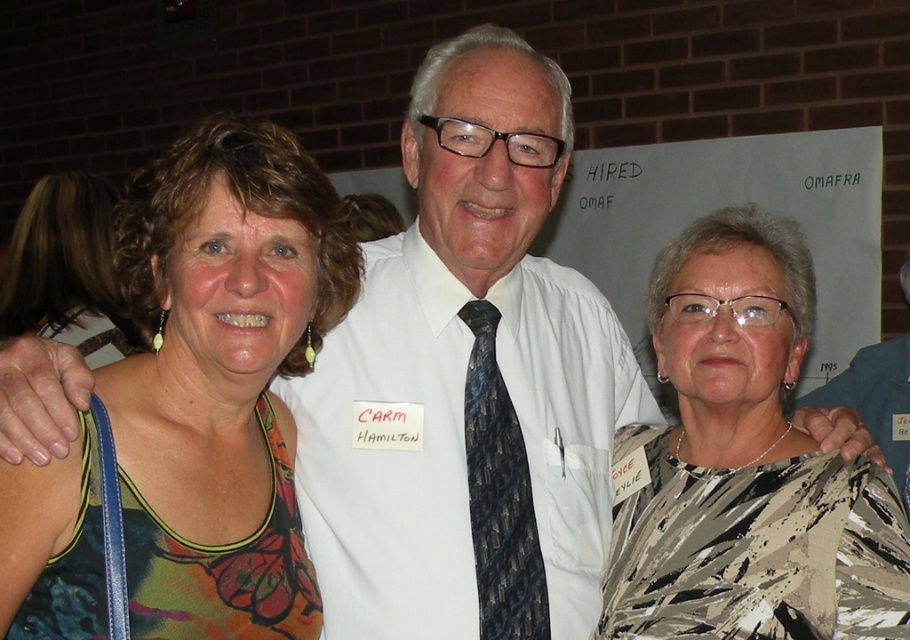
Question: Is multicolored fabric top at center wider than printed silk blouse at center?

Choices:
 (A) no
 (B) yes

Answer: (A)

Question: Which of the following is the closest to the observer?

Choices:
 (A) (124, 390)
 (B) (720, 525)

Answer: (A)

Question: Is multicolored fabric top at center positioned behind printed silk blouse at center?

Choices:
 (A) yes
 (B) no

Answer: (B)

Question: Does multicolored fabric top at center have a larger size compared to dark blue textured tie at center?

Choices:
 (A) yes
 (B) no

Answer: (A)

Question: Which of these objects is positioned closest to the printed silk blouse at center?

Choices:
 (A) multicolored fabric top at center
 (B) multicolored fabric at left
 (C) dark blue textured tie at center

Answer: (C)

Question: Which of the following is the farthest from the observer?

Choices:
 (A) (64, 262)
 (B) (774, 561)
 (C) (524, 600)
 (D) (61, 460)

Answer: (A)